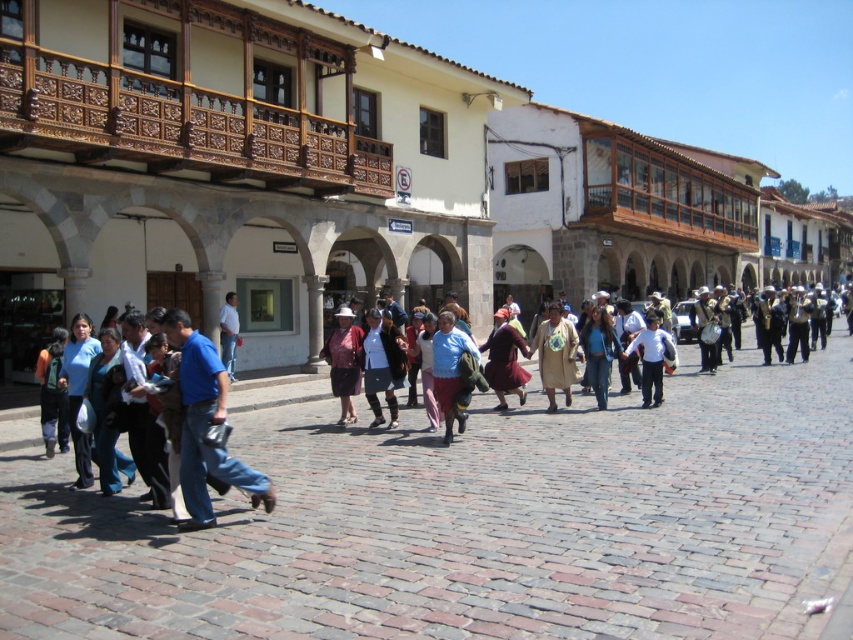
Is the position of blue cotton shirt at center less distant than that of matte red skirt at center?

Yes, it is in front of matte red skirt at center.

Between point (219, 452) and point (344, 328), which one is positioned behind?

Point (344, 328)

The height and width of the screenshot is (640, 853). Identify the location of blue cotton shirt at center. (206, 426).

Who is higher up, light blue fabric at center or matte red skirt at center?

light blue fabric at center is above.

Which of these two, light blue fabric at center or matte red skirt at center, stands taller?

matte red skirt at center is taller.

This screenshot has height=640, width=853. What are the coordinates of `light blue fabric at center` in the screenshot? It's located at (450, 371).

Between matte red skirt at center and blue denim jeans at center, which one appears on the left side from the viewer's perspective?

Positioned to the left is matte red skirt at center.

This screenshot has width=853, height=640. What are the coordinates of `matte red skirt at center` in the screenshot? It's located at (344, 362).